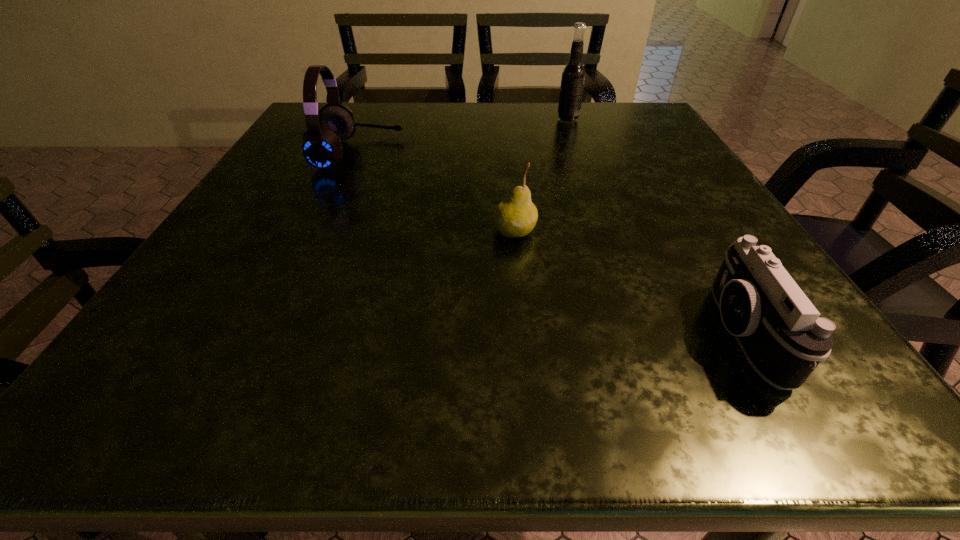
This screenshot has height=540, width=960. I want to click on vacant point located between the camera and the pear, so click(628, 283).

Find the location of a particular element. The height and width of the screenshot is (540, 960). object that is the third closest to the rightmost object is located at coordinates (321, 143).

This screenshot has width=960, height=540. In order to click on object that ranks as the third closest to the camera in this screenshot , I will do `click(321, 143)`.

Identify the location of vacant space that satisfies the following two spatial constraints: 1. on the label of the farthest object; 2. on the front side of the pear. This screenshot has width=960, height=540. (609, 232).

Find the location of a particular element. free spot that satisfies the following two spatial constraints: 1. on the ear cushions of the headset; 2. on the back side of the pear is located at coordinates click(324, 232).